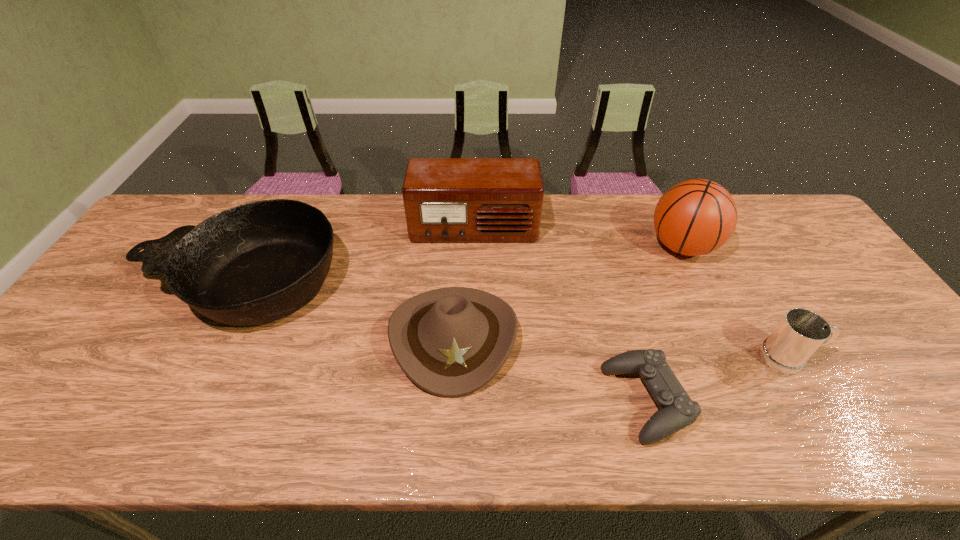
This screenshot has height=540, width=960. Identify the location of free spot at the near edge of the desktop. (729, 413).

Where is `vacant space at the left edge`? vacant space at the left edge is located at coordinates (131, 267).

In the image, there is a desktop. What are the coordinates of `vacant space at the right edge` in the screenshot? It's located at (800, 291).

At what (x,y) coordinates should I click in order to perform the action: click on vacant region at the far left corner of the desktop. Please return your answer as a coordinate pair (x, y). Looking at the image, I should click on (166, 230).

I want to click on vacant space at the far right corner, so click(x=788, y=211).

At what (x,y) coordinates should I click in order to perform the action: click on vacant space that is in between the mug and the radio receiver. Please return your answer as a coordinate pair (x, y). This screenshot has height=540, width=960. Looking at the image, I should click on [x=632, y=294].

You are a GUI agent. You are given a task and a screenshot of the screen. Output one action in this format:
    pyautogui.click(x=<x>, y=<y>)
    Task: Click on the vacant point located between the cowboy hat and the shortest object
    The width and height of the screenshot is (960, 540).
    Given the screenshot: What is the action you would take?
    pyautogui.click(x=550, y=369)

The height and width of the screenshot is (540, 960). In order to click on empty space that is in between the shortest object and the basketball in this screenshot , I will do `click(663, 324)`.

Locate an element on the screen. empty location between the radio receiver and the frying pan is located at coordinates (358, 256).

Locate an element on the screen. The width and height of the screenshot is (960, 540). vacant area that lies between the radio receiver and the basketball is located at coordinates [x=578, y=238].